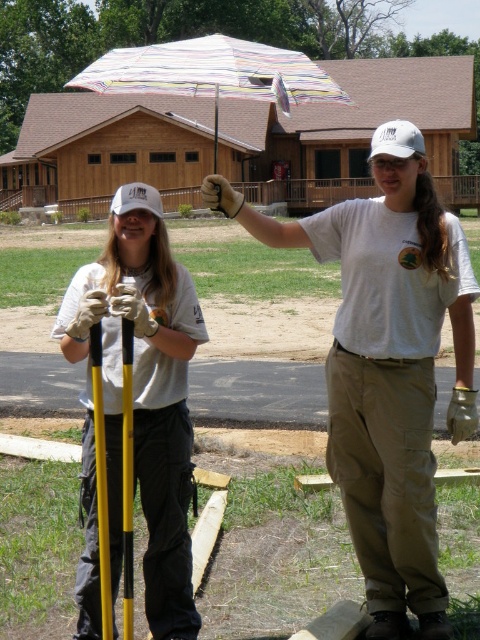
Question: Which object is closer to the camera taking this photo?

Choices:
 (A) white cotton shirt at center
 (B) yellow matte pole at center
 (C) matte yellow pole at center
 (D) brown leather glove at upper center

Answer: (B)

Question: Which point appears closest to the camera in this image?

Choices:
 (A) (132, 205)
 (B) (126, 545)

Answer: (B)

Question: Does striped fabric umbrella at upper center have a smaller size compared to brown leather glove at upper center?

Choices:
 (A) yes
 (B) no

Answer: (B)

Question: From the image, what is the correct spatial relationship of yellow matte pole at center in relation to white matte baseball cap at upper left?

Choices:
 (A) below
 (B) above

Answer: (A)

Question: Considering the relative positions of matte yellow pole at center and brown leather glove at upper center in the image provided, where is matte yellow pole at center located with respect to brown leather glove at upper center?

Choices:
 (A) left
 (B) right

Answer: (B)

Question: Which object is farther from the camera taking this photo?

Choices:
 (A) striped fabric umbrella at upper center
 (B) matte yellow pole at center

Answer: (A)